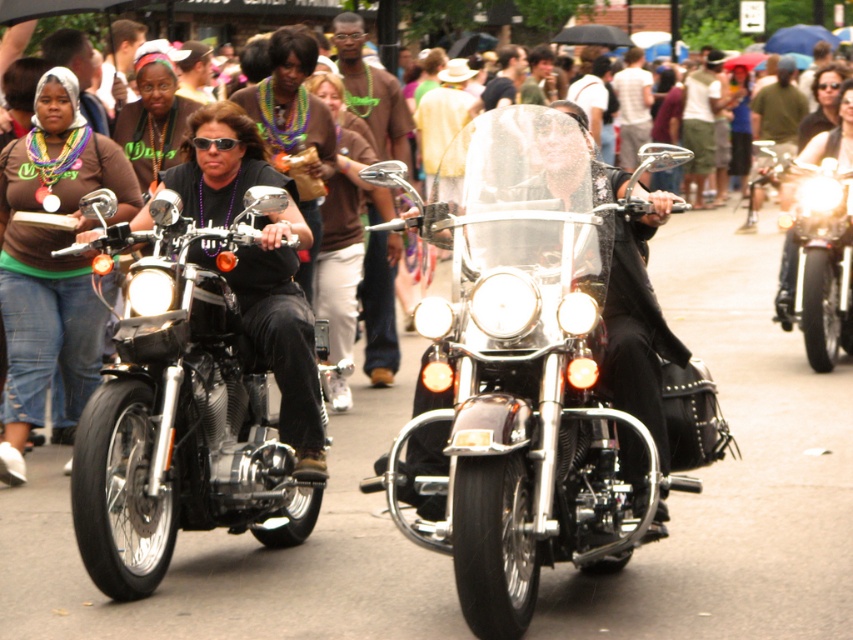
Question: Is shiny chrome motorcycle at left to the right of sunglasses at center from the viewer's perspective?

Choices:
 (A) yes
 (B) no

Answer: (A)

Question: Is shiny chrome motorcycle at center closer to the viewer compared to sunglasses at center?

Choices:
 (A) yes
 (B) no

Answer: (A)

Question: Based on their relative distances, which object is farther from the shiny black leather jacket at center?

Choices:
 (A) shiny chrome motorcycle at center
 (B) shiny chrome motorcycle at left
 (C) sunglasses at center

Answer: (A)

Question: Considering the relative positions of shiny chrome motorcycle at center and shiny black leather jacket at center in the image provided, where is shiny chrome motorcycle at center located with respect to shiny black leather jacket at center?

Choices:
 (A) right
 (B) left

Answer: (A)

Question: Which point is closer to the camera?

Choices:
 (A) (149, 442)
 (B) (489, 324)
 (C) (223, 141)

Answer: (B)

Question: Among these objects, which one is nearest to the camera?

Choices:
 (A) sunglasses at center
 (B) shiny black leather jacket at center
 (C) shiny chrome motorcycle at left
 (D) shiny chrome motorcycle at center

Answer: (D)